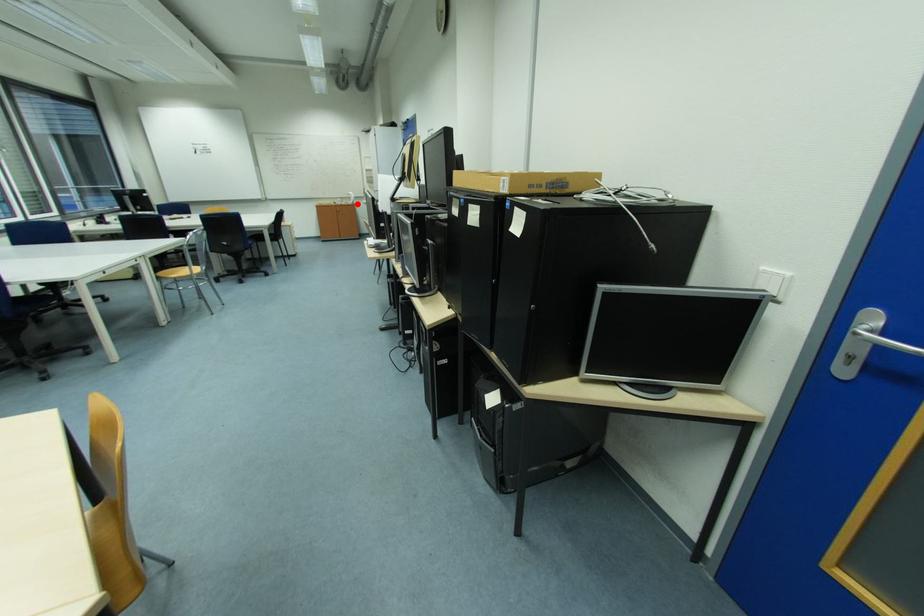
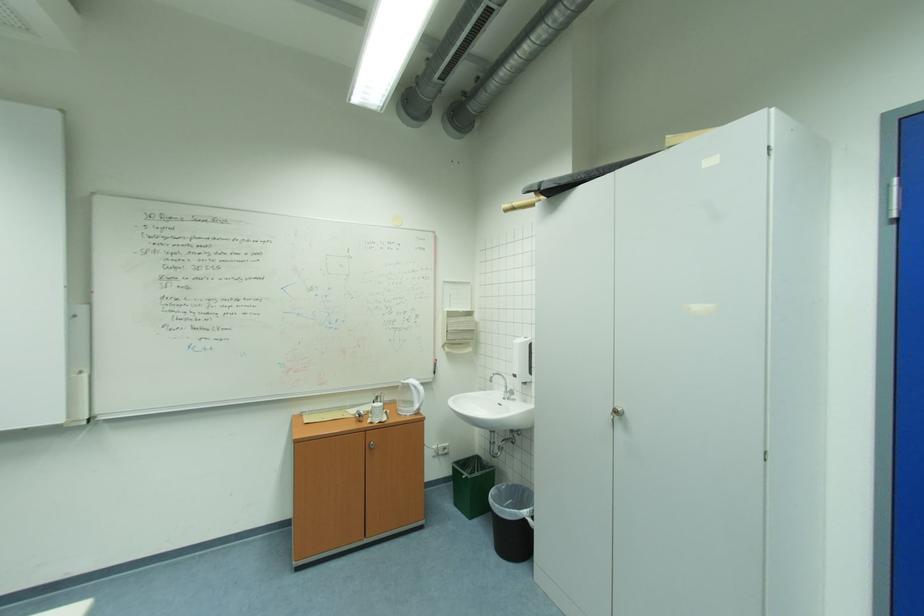
Locate, in the second image, the point that corresponds to the highlighted location in the first image.

(415, 411)